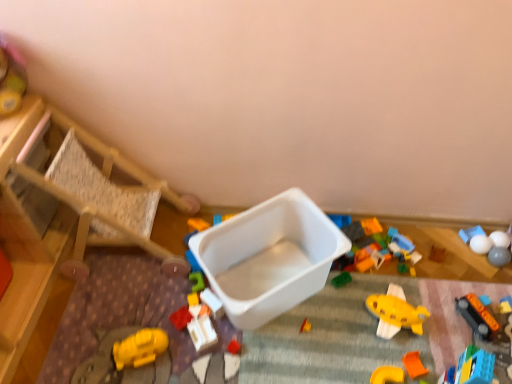
I want to click on vacant area that lies between orange plastic train at lower right, which is the 5th toy in right-to-left order, and white plastic container at center, which is counted as the 12th toy, starting from the right, so click(x=350, y=332).